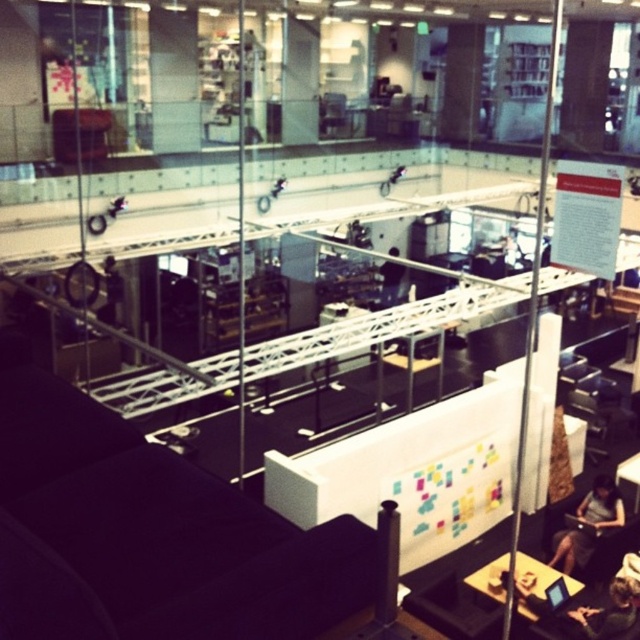
Question: Which object is closer to the camera taking this photo?

Choices:
 (A) black plastic laptop at lower right
 (B) dark gray fabric person at lower right
 (C) black leather jacket at center
 (D) black fabric person at center

Answer: (B)

Question: Among these points, which one is farthest from the camera?

Choices:
 (A) (392, 273)
 (B) (564, 595)
 (C) (580, 529)

Answer: (A)

Question: Which point is farther to the camera?

Choices:
 (A) black glossy tablet at lower right
 (B) dark hair person at lower right
 (C) black leather jacket at center

Answer: (C)

Question: In this image, where is black glossy tablet at lower right located relative to black plastic laptop at lower right?

Choices:
 (A) right
 (B) left

Answer: (B)

Question: Does black fabric person at center have a greater width compared to black plastic laptop at lower right?

Choices:
 (A) no
 (B) yes

Answer: (B)

Question: Is black leather jacket at center to the right of black fabric person at center from the viewer's perspective?

Choices:
 (A) yes
 (B) no

Answer: (B)